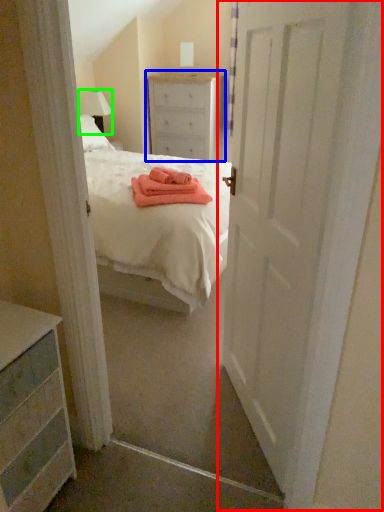
Question: Based on their relative distances, which object is nearer to door (highlighted by a red box)? Choose from chest of drawers (highlighted by a blue box) and lamp (highlighted by a green box).

Choices:
 (A) chest of drawers
 (B) lamp

Answer: (A)